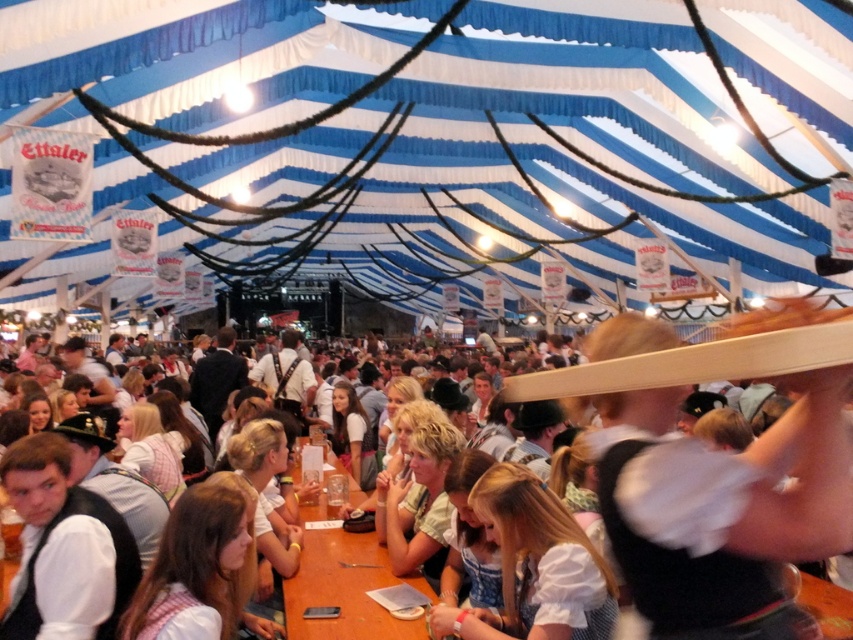
Question: Which point is closer to the camera?

Choices:
 (A) brown wooden table at center
 (B) white fabric dress at center
 (C) white cotton blouse at lower center

Answer: (B)

Question: Does white cotton blouse at lower center appear under brown wooden table at center?

Choices:
 (A) yes
 (B) no

Answer: (B)

Question: Does white cotton blouse at lower center have a lesser width compared to brown wooden table at center?

Choices:
 (A) yes
 (B) no

Answer: (A)

Question: Which object appears farthest from the camera in this image?

Choices:
 (A) white cotton blouse at lower center
 (B) brown wooden table at center
 (C) white fabric dress at center

Answer: (B)

Question: Can you confirm if white fabric dress at center is positioned to the right of white cotton blouse at lower center?

Choices:
 (A) yes
 (B) no

Answer: (A)

Question: Which of the following is the closest to the observer?

Choices:
 (A) (714, 588)
 (B) (305, 602)

Answer: (A)